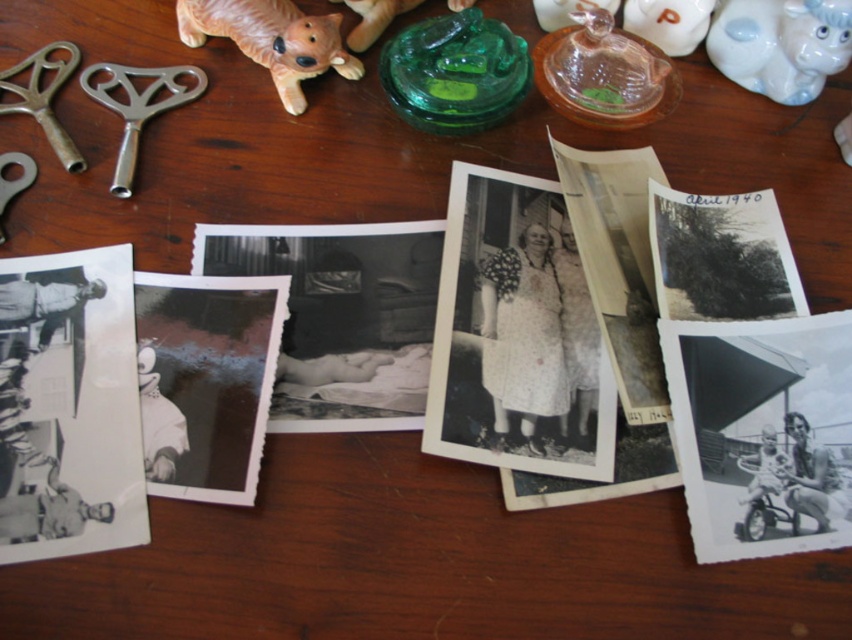
Question: Which point appears closest to the camera in this image?

Choices:
 (A) (614, 6)
 (B) (139, 376)
 (C) (776, 26)
 (D) (646, 17)

Answer: (B)

Question: Which point is farther to the camera?

Choices:
 (A) transparent glass figurine at upper center
 (B) white glossy ceramic toy at upper right
 (C) orange plastic dog at upper left

Answer: (A)

Question: Among these objects, which one is farthest from the camera?

Choices:
 (A) orange plastic dog at upper left
 (B) white fabric doll at lower left

Answer: (A)

Question: Where is orange plastic dog at upper left located in relation to translucent glass jar at upper center in the image?

Choices:
 (A) left
 (B) right

Answer: (A)

Question: Does white fabric doll at lower left appear over translucent glass jar at upper center?

Choices:
 (A) no
 (B) yes

Answer: (A)

Question: Does orange plastic dog at upper left appear over white fabric doll at lower left?

Choices:
 (A) no
 (B) yes

Answer: (B)